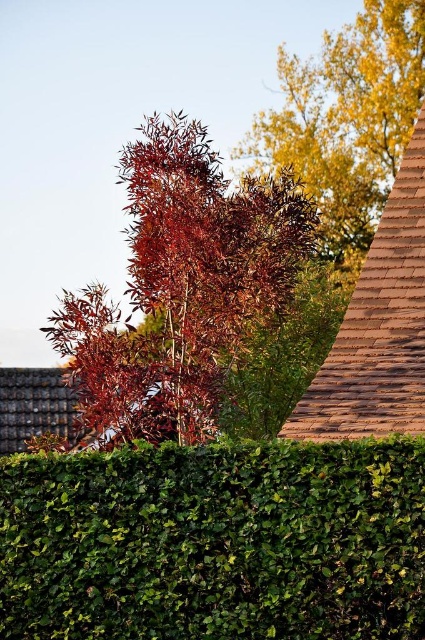
Question: Among these objects, which one is farthest from the camera?

Choices:
 (A) glossy red autumn tree at center
 (B) golden yellow leaves at upper right
 (C) green leafy hedge at center

Answer: (B)

Question: Does green leafy hedge at center have a lesser width compared to glossy red autumn tree at center?

Choices:
 (A) yes
 (B) no

Answer: (B)

Question: Which object appears farthest from the camera in this image?

Choices:
 (A) green leafy hedge at center
 (B) glossy red autumn tree at center
 (C) golden yellow leaves at upper right

Answer: (C)

Question: Can you confirm if green leafy hedge at center is positioned below glossy red autumn tree at center?

Choices:
 (A) no
 (B) yes

Answer: (B)

Question: Considering the real-world distances, which object is closest to the glossy red autumn tree at center?

Choices:
 (A) golden yellow leaves at upper right
 (B) green leafy hedge at center

Answer: (B)

Question: Can you confirm if green leafy hedge at center is positioned to the right of golden yellow leaves at upper right?

Choices:
 (A) yes
 (B) no

Answer: (B)